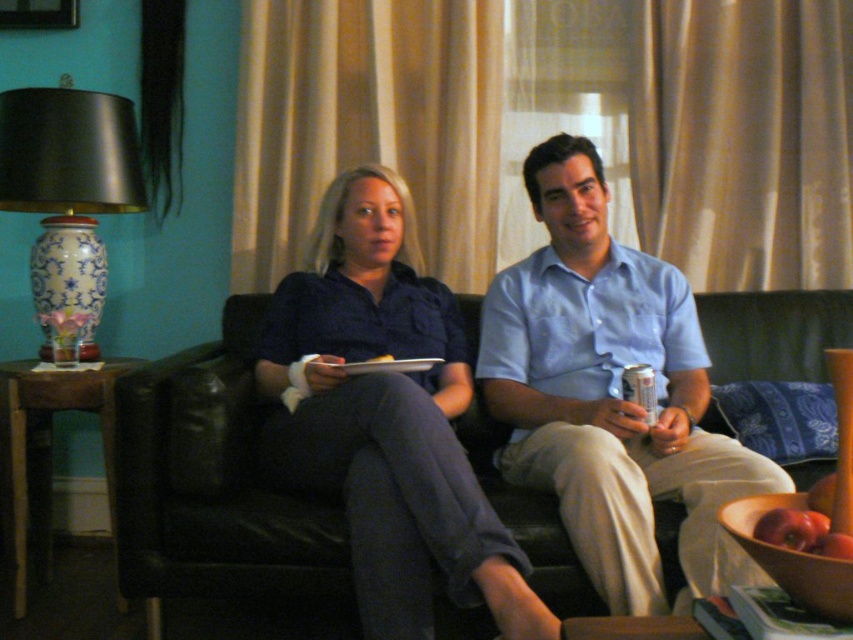
You are organizing a small event and need to place a decorative item on a table. The table has limited space. Given the sizes of the matte blue shirt at center and the blue and white porcelain vase at left, which object would you choose to place on the table to maximize space efficiency?

The blue and white porcelain vase at left is smaller than the matte blue shirt at center, so placing the blue and white porcelain vase at left on the table would maximize space efficiency.

You are standing in the living room and want to reach a point that is exactly at coordinates point (x=375, y=413). If you can move forward 4.92 feet, will you be able to reach that point?

The distance of point (x=375, y=413) from viewer is 4.92 feet, so moving forward exactly 4.92 feet will bring you to that point.